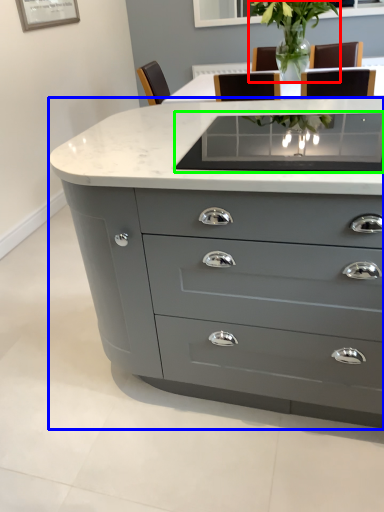
Question: Which is farther away from plant (highlighted by a red box)? chest of drawers (highlighted by a blue box) or glass table (highlighted by a green box)?

Choices:
 (A) chest of drawers
 (B) glass table

Answer: (A)